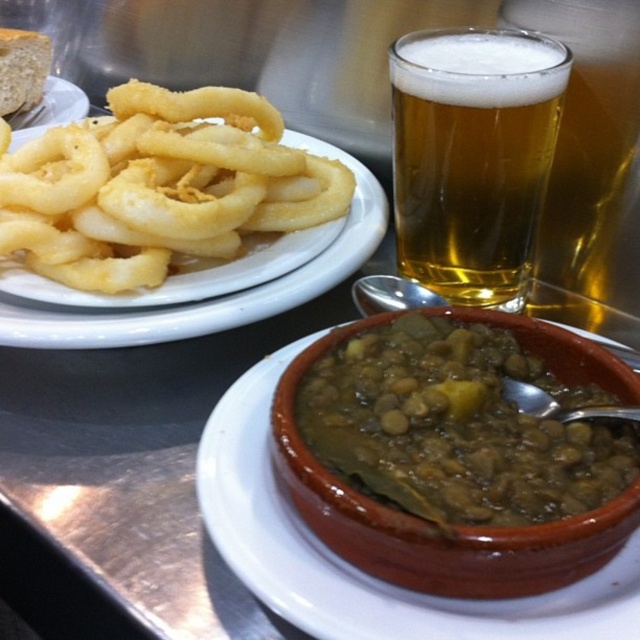
Which is more to the right, golden amber liquid at upper right or golden fried calamari at left?

Positioned to the right is golden amber liquid at upper right.

Is point (504, 93) farther from viewer compared to point (282, 291)?

No, it is not.

At what (x,y) coordinates should I click in order to perform the action: click on golden amber liquid at upper right. Please return your answer as a coordinate pair (x, y). Looking at the image, I should click on (472, 156).

Between point (563, 472) and point (237, 321), which one is positioned in front?

Point (563, 472) is more forward.

From the picture: Does green matte stew at center appear on the left side of golden fried calamari at left?

Incorrect, green matte stew at center is not on the left side of golden fried calamari at left.

The width and height of the screenshot is (640, 640). In order to click on green matte stew at center in this screenshot , I will do `click(458, 426)`.

Locate an element on the screen. Image resolution: width=640 pixels, height=640 pixels. green matte stew at center is located at coordinates 458,426.

Does green matte stew at center have a lesser height compared to golden amber liquid at upper right?

Yes, green matte stew at center is shorter than golden amber liquid at upper right.

Is green matte stew at center thinner than golden amber liquid at upper right?

In fact, green matte stew at center might be wider than golden amber liquid at upper right.

Image resolution: width=640 pixels, height=640 pixels. Identify the location of green matte stew at center. (458, 426).